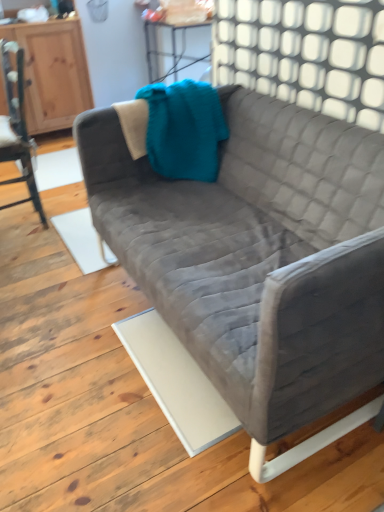
Question: From the image's perspective, is velvet gray couch at center below white textured wall at upper center?

Choices:
 (A) no
 (B) yes

Answer: (B)

Question: Is velvet gray couch at center positioned in front of white textured wall at upper center?

Choices:
 (A) yes
 (B) no

Answer: (A)

Question: Can you confirm if velvet gray couch at center is bigger than white textured wall at upper center?

Choices:
 (A) yes
 (B) no

Answer: (A)

Question: From the image's perspective, is velvet gray couch at center located above white textured wall at upper center?

Choices:
 (A) yes
 (B) no

Answer: (B)

Question: Considering the relative sizes of velvet gray couch at center and white textured wall at upper center in the image provided, is velvet gray couch at center taller than white textured wall at upper center?

Choices:
 (A) yes
 (B) no

Answer: (A)

Question: Considering the relative sizes of velvet gray couch at center and white textured wall at upper center in the image provided, is velvet gray couch at center smaller than white textured wall at upper center?

Choices:
 (A) yes
 (B) no

Answer: (B)

Question: From the image's perspective, is wooden dresser at left on velvet gray couch at center?

Choices:
 (A) yes
 (B) no

Answer: (A)

Question: Is wooden dresser at left bigger than velvet gray couch at center?

Choices:
 (A) yes
 (B) no

Answer: (B)

Question: Considering the relative positions of wooden dresser at left and velvet gray couch at center in the image provided, is wooden dresser at left to the right of velvet gray couch at center from the viewer's perspective?

Choices:
 (A) no
 (B) yes

Answer: (A)

Question: Is wooden dresser at left completely or partially outside of velvet gray couch at center?

Choices:
 (A) no
 (B) yes

Answer: (B)

Question: Does wooden dresser at left have a greater width compared to velvet gray couch at center?

Choices:
 (A) yes
 (B) no

Answer: (B)

Question: Is wooden dresser at left smaller than velvet gray couch at center?

Choices:
 (A) yes
 (B) no

Answer: (A)

Question: Does velvet gray couch at center have a greater width compared to wooden chair at left?

Choices:
 (A) yes
 (B) no

Answer: (A)